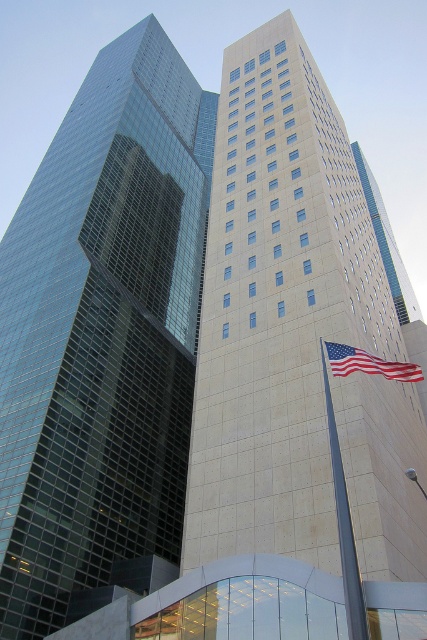
Question: Does glassy reflective skyscraper at left lie in front of white stone building at center?

Choices:
 (A) yes
 (B) no

Answer: (A)

Question: Among these objects, which one is farthest from the camera?

Choices:
 (A) white stone building at center
 (B) american flag at right

Answer: (A)

Question: Which is farther from the american flag at right?

Choices:
 (A) white stone building at center
 (B) glassy reflective skyscraper at left

Answer: (B)

Question: Is glassy reflective skyscraper at left behind american flag at right?

Choices:
 (A) no
 (B) yes

Answer: (B)

Question: Which of the following is the farthest from the observer?

Choices:
 (A) (137, 444)
 (B) (359, 176)
 (C) (365, 371)

Answer: (B)

Question: Is white stone building at center in front of american flag at right?

Choices:
 (A) no
 (B) yes

Answer: (A)